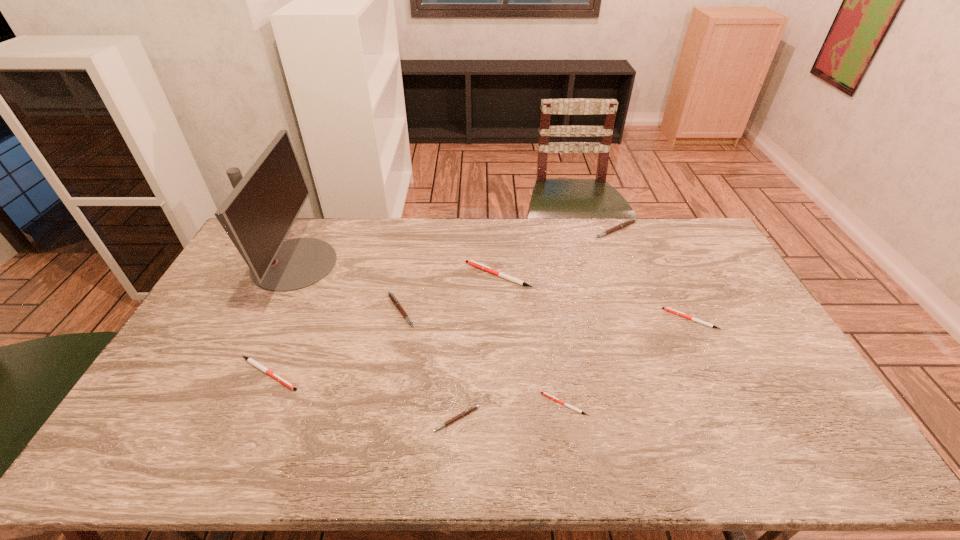
At what (x,y) coordinates should I click in order to perform the action: click on vacant region located on the clicker of the biggest white pen. Please return your answer as a coordinate pair (x, y). The height and width of the screenshot is (540, 960). Looking at the image, I should click on (373, 275).

Identify the location of vacant space situated 0.060m at the nib of the second pen from left to right. pyautogui.click(x=436, y=310).

Identify the location of free location located on the clicker of the third smallest white pen. tap(400, 374).

The height and width of the screenshot is (540, 960). What are the coordinates of `vacant space located on the clicker of the third nearest white pen` in the screenshot? It's located at (612, 319).

In order to click on blank space located 0.120m on the clicker of the third nearest white pen in this screenshot , I will do `click(628, 319)`.

You are a GUI agent. You are given a task and a screenshot of the screen. Output one action in this format:
    pyautogui.click(x=<x>, y=<y>)
    Task: Click on the free space located 0.210m on the clicker of the third nearest white pen
    
    Given the screenshot: What is the action you would take?
    pyautogui.click(x=599, y=319)

What are the coordinates of `vacant area situated 0.370m on the clicker of the nearest white pen` in the screenshot? It's located at (401, 404).

At what (x,y) coordinates should I click in order to perform the action: click on vacant area situated on the clicker of the nearest white pen. Please return your answer as a coordinate pair (x, y). Image resolution: width=960 pixels, height=540 pixels. Looking at the image, I should click on (432, 404).

Where is `vacant area situated on the clicker of the nearest white pen`? The width and height of the screenshot is (960, 540). vacant area situated on the clicker of the nearest white pen is located at coordinates (428, 404).

The height and width of the screenshot is (540, 960). Find the location of `computer monitor that is at the far edge`. computer monitor that is at the far edge is located at coordinates (258, 214).